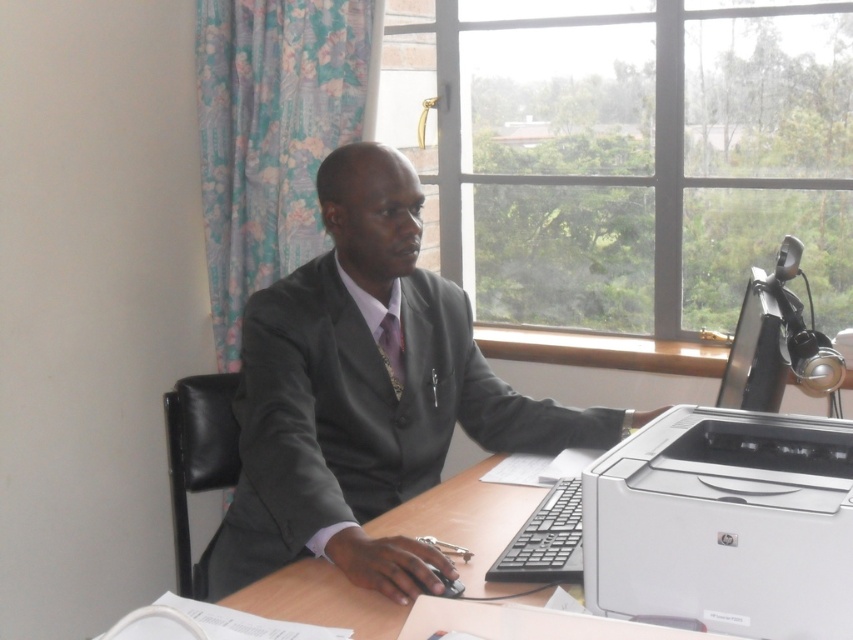
You are a fashion designer analyzing a mannequin dressed in the matte gray suit at center and patterned silk tie at center. Which clothing item is wider?

The matte gray suit at center is wider than the patterned silk tie at center.

You are an interior designer assessing the office layout. The matte gray suit at center and the white matte printer at lower right are both in the room. Which object takes up more space in the office?

The matte gray suit at center has a larger size compared to the white matte printer at lower right, so it takes up more space in the office.

You are a delivery person who needs to hand over a package to the man at the desk. The package must be placed on the desk in a position that is closer to the clear glass window at upper center than to the patterned silk tie at center. Where should you place the package?

The clear glass window at upper center is to the right of the patterned silk tie at center, so you should place the package on the desk to the right side of the patterned silk tie at center to ensure it is closer to the clear glass window at upper center.